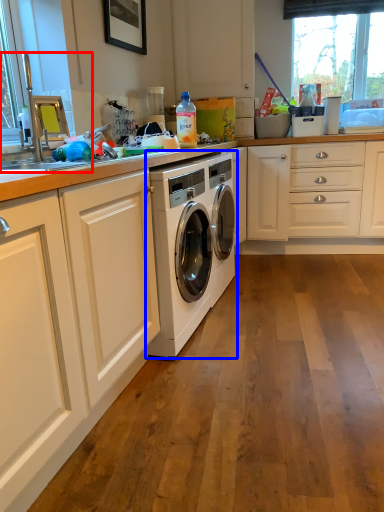
Question: Which of the following is the closest to the observer, sink (highlighted by a red box) or washing machine (highlighted by a blue box)?

Choices:
 (A) sink
 (B) washing machine

Answer: (A)